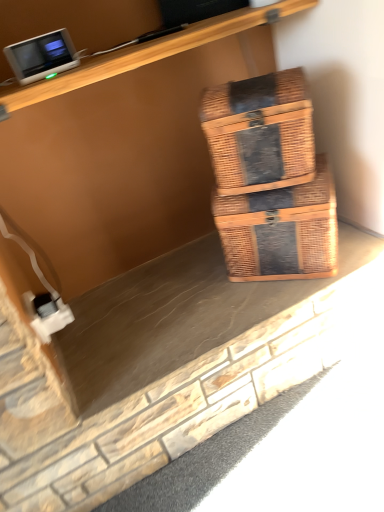
Question: Considering the positions of woven brown box at center, which is counted as the 2th box, starting from the top, and matte gray monitor at upper left in the image, is woven brown box at center, which is counted as the 2th box, starting from the top, bigger or smaller than matte gray monitor at upper left?

Choices:
 (A) small
 (B) big

Answer: (B)

Question: Looking at their shapes, would you say woven brown box at center, which ranks as the 1th box in bottom-to-top order, is wider or thinner than matte gray monitor at upper left?

Choices:
 (A) wide
 (B) thin

Answer: (A)

Question: Based on their relative distances, which object is nearer to the woven brown box at center, arranged as the 2th box when ordered from the bottom?

Choices:
 (A) woven brown box at center, which is counted as the 2th box, starting from the top
 (B) white plastic electric outlet at lower left
 (C) matte gray monitor at upper left

Answer: (A)

Question: Estimate the real-world distances between objects in this image. Which object is farther from the woven brown box at center, which appears as the first box when viewed from the top?

Choices:
 (A) woven brown box at center, which ranks as the 1th box in bottom-to-top order
 (B) white plastic electric outlet at lower left
 (C) matte gray monitor at upper left

Answer: (B)